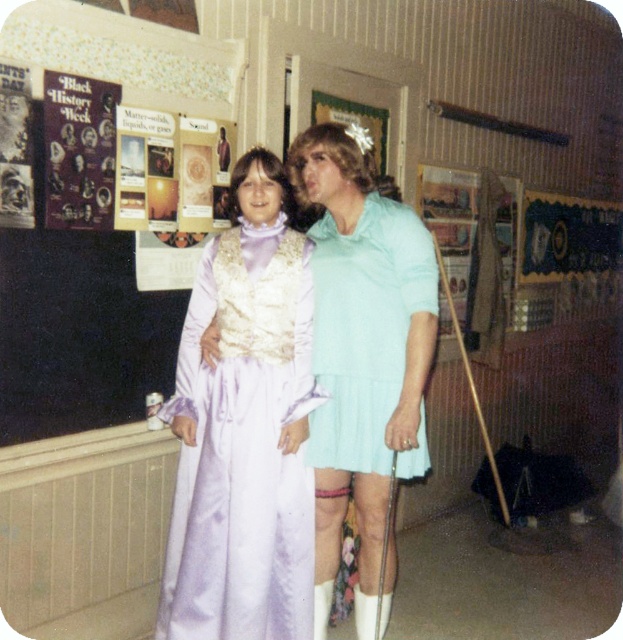
Question: Does lavender satin dress at center have a smaller size compared to light blue pleated skirt at center?

Choices:
 (A) yes
 (B) no

Answer: (B)

Question: Among these points, which one is nearest to the camera?

Choices:
 (A) (333, 362)
 (B) (305, 195)
 (C) (310, 294)

Answer: (A)

Question: Can you confirm if lavender satin dress at center is positioned below light blue pleated dress at center?

Choices:
 (A) no
 (B) yes

Answer: (B)

Question: Is lavender satin dress at center bigger than light blue pleated dress at center?

Choices:
 (A) no
 (B) yes

Answer: (A)

Question: Among these objects, which one is nearest to the camera?

Choices:
 (A) light blue pleated dress at center
 (B) light blue pleated skirt at center

Answer: (A)

Question: Estimate the real-world distances between objects in this image. Which object is farther from the light blue pleated skirt at center?

Choices:
 (A) light blue pleated dress at center
 (B) lavender satin dress at center

Answer: (B)